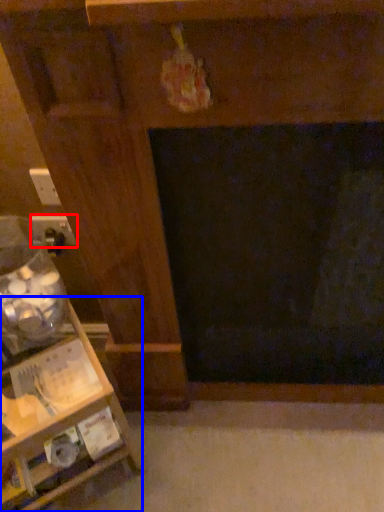
Question: Which object appears closest to the camera in this image, electric outlet (highlighted by a red box) or furniture (highlighted by a blue box)?

Choices:
 (A) electric outlet
 (B) furniture

Answer: (B)